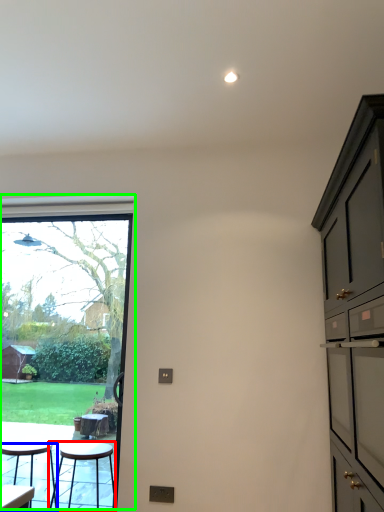
Question: Which object is the closest to the stool (highlighted by a red box)? Choose among these: stool (highlighted by a blue box) or window (highlighted by a green box).

Choices:
 (A) stool
 (B) window

Answer: (A)